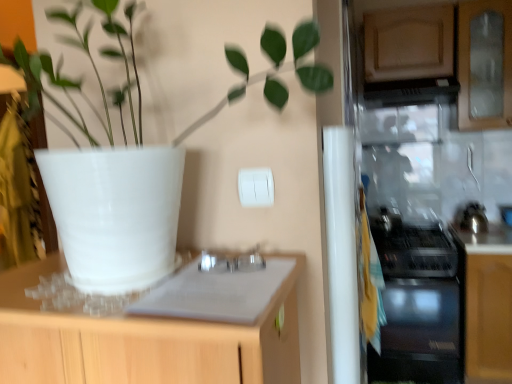
Question: From a real-world perspective, is black glossy exhaust hood at upper right under black glass gas stove at right?

Choices:
 (A) yes
 (B) no

Answer: (B)

Question: From the image's perspective, is black glossy exhaust hood at upper right under black glass gas stove at right?

Choices:
 (A) yes
 (B) no

Answer: (B)

Question: Considering the relative sizes of black glossy exhaust hood at upper right and black glass gas stove at right in the image provided, is black glossy exhaust hood at upper right wider than black glass gas stove at right?

Choices:
 (A) yes
 (B) no

Answer: (B)

Question: Can black glass gas stove at right be found inside black glossy exhaust hood at upper right?

Choices:
 (A) yes
 (B) no

Answer: (B)

Question: Considering the relative sizes of black glossy exhaust hood at upper right and black glass gas stove at right in the image provided, is black glossy exhaust hood at upper right bigger than black glass gas stove at right?

Choices:
 (A) no
 (B) yes

Answer: (A)

Question: Is black glossy exhaust hood at upper right positioned far away from black glass gas stove at right?

Choices:
 (A) yes
 (B) no

Answer: (B)

Question: Is black glossy exhaust hood at upper right far from white matte pot at upper left?

Choices:
 (A) no
 (B) yes

Answer: (B)

Question: Does black glossy exhaust hood at upper right have a lesser width compared to white matte pot at upper left?

Choices:
 (A) no
 (B) yes

Answer: (A)

Question: Considering the relative positions of black glossy exhaust hood at upper right and white matte pot at upper left in the image provided, is black glossy exhaust hood at upper right behind white matte pot at upper left?

Choices:
 (A) no
 (B) yes

Answer: (B)

Question: Is black glossy exhaust hood at upper right shorter than white matte pot at upper left?

Choices:
 (A) no
 (B) yes

Answer: (B)

Question: Is white matte pot at upper left completely or partially inside black glossy exhaust hood at upper right?

Choices:
 (A) yes
 (B) no

Answer: (B)

Question: Considering the relative sizes of black glossy exhaust hood at upper right and white matte pot at upper left in the image provided, is black glossy exhaust hood at upper right taller than white matte pot at upper left?

Choices:
 (A) no
 (B) yes

Answer: (A)

Question: Considering the relative sizes of satin black oven at lower right and black glossy exhaust hood at upper right in the image provided, is satin black oven at lower right smaller than black glossy exhaust hood at upper right?

Choices:
 (A) no
 (B) yes

Answer: (A)